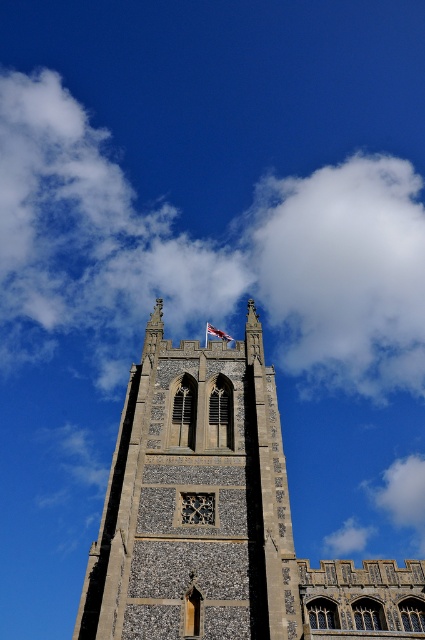
You are standing in front of the historic church tower and notice two points marked on the tower. The first point is at coordinate point (x=204, y=632) and the second is at point (x=223, y=333). Which point is nearer to you?

Point (x=204, y=632) is closer to the viewer than point (x=223, y=333).

You are standing in front of the historic church tower and want to take a photo. There is a point marked at coordinates point (342, 272). Where is this point located in relation to the scene?

The point (342, 272) is located on the white fluffy cloud at upper center.

Looking at this image, you are a photographer planning to capture the stone tower at center and the white fluffy cloud at upper center in a single frame. Based on their sizes, which object would appear smaller in the photo?

The stone tower at center appears smaller in the photo because it has a lesser width compared to the white fluffy cloud at upper center.